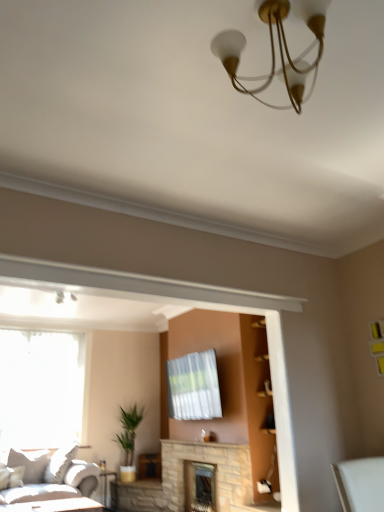
The image size is (384, 512). Describe the element at coordinates (274, 49) in the screenshot. I see `matte gold chandelier at upper center` at that location.

Measure the distance between point (126, 448) and camera.

Point (126, 448) and camera are 5.98 meters apart.

This screenshot has width=384, height=512. What do you see at coordinates (128, 440) in the screenshot?
I see `green leafy plant at center` at bounding box center [128, 440].

In order to click on white sheer curtain at left in this screenshot , I will do `click(40, 388)`.

Identify the location of matte gold chandelier at upper center. (274, 49).

Considering the points (242, 482) and (60, 475), which point is behind, point (242, 482) or point (60, 475)?

Point (60, 475)

How different are the orientations of stone fireplace at center, which is the 1th fireplace from front to back, and light gray fabric couch at lower left in degrees?

The facing directions of stone fireplace at center, which is the 1th fireplace from front to back, and light gray fabric couch at lower left are 89.3 degrees apart.

Can you confirm if stone fireplace at center, which ranks as the second fireplace in back-to-front order, is wider than light gray fabric couch at lower left?

In fact, stone fireplace at center, which ranks as the second fireplace in back-to-front order, might be narrower than light gray fabric couch at lower left.

From the image's perspective, who appears lower, stone fireplace at center, which is the 1th fireplace from front to back, or light gray fabric couch at lower left?

stone fireplace at center, which is the 1th fireplace from front to back, from the image's perspective.

From a real-world perspective, does white glossy table at lower left sit lower than white sheer curtain at left?

Yes, from a real-world perspective, white glossy table at lower left is under white sheer curtain at left.

The width and height of the screenshot is (384, 512). Find the location of `window above the white glossy table at lower left (from the image's perspective)`. window above the white glossy table at lower left (from the image's perspective) is located at coordinates (40, 388).

Who is taller, white glossy table at lower left or white sheer curtain at left?

white sheer curtain at left is taller.

Is white glossy table at lower left inside the boundaries of white sheer curtain at left, or outside?

white glossy table at lower left is outside white sheer curtain at left.

Is light gray fabric couch at lower left taller or shorter than white glossy table at lower left?

light gray fabric couch at lower left is taller than white glossy table at lower left.

I want to click on studio couch above the white glossy table at lower left (from a real-world perspective), so click(47, 477).

Is light gray fabric couch at lower left not within white glossy table at lower left?

light gray fabric couch at lower left is positioned outside white glossy table at lower left.

Considering the relative sizes of green leafy plant at center and light gray fabric couch at lower left in the image provided, is green leafy plant at center thinner than light gray fabric couch at lower left?

Indeed, green leafy plant at center has a lesser width compared to light gray fabric couch at lower left.

Is green leafy plant at center in contact with light gray fabric couch at lower left?

green leafy plant at center and light gray fabric couch at lower left are clearly separated.

From a real-world perspective, is green leafy plant at center positioned under light gray fabric couch at lower left based on gravity?

Incorrect, from a real-world perspective, green leafy plant at center is higher than light gray fabric couch at lower left.

Can you confirm if white sheer curtain at left is wider than green leafy plant at center?

Incorrect, the width of white sheer curtain at left does not surpass that of green leafy plant at center.

Consider the image. Is the position of white sheer curtain at left less distant than that of green leafy plant at center?

Yes.

Is white sheer curtain at left facing towards green leafy plant at center?

No, white sheer curtain at left is not aimed at green leafy plant at center.

Which is behind, point (284, 5) or point (129, 410)?

The point (129, 410) is behind.

From the image's perspective, is matte gold chandelier at upper center on top of green leafy plant at center?

Yes, from the image's perspective, matte gold chandelier at upper center is above green leafy plant at center.

Considering the relative positions of matte gold chandelier at upper center and green leafy plant at center in the image provided, is matte gold chandelier at upper center to the left of green leafy plant at center from the viewer's perspective?

Result: Incorrect, matte gold chandelier at upper center is not on the left side of green leafy plant at center.

Choose the correct answer: Is matte gold chandelier at upper center inside green leafy plant at center or outside it?

matte gold chandelier at upper center is spatially situated outside green leafy plant at center.

From a real-world perspective, is light gray fabric couch at lower left positioned over stone fireplace at center, which is the 1th fireplace from front to back, based on gravity?

Indeed, from a real-world perspective, light gray fabric couch at lower left stands above stone fireplace at center, which is the 1th fireplace from front to back.

Is light gray fabric couch at lower left inside the boundaries of stone fireplace at center, which is the 1th fireplace from front to back, or outside?

light gray fabric couch at lower left lies outside stone fireplace at center, which is the 1th fireplace from front to back.

Which fireplace is the 1st one when counting from the back of the light gray fabric couch at lower left? Please provide its 2D coordinates.

[(215, 476)]

Between light gray fabric couch at lower left and stone fireplace at center, which ranks as the second fireplace in back-to-front order, which one has larger width?

With larger width is light gray fabric couch at lower left.

Where is `the 1st fireplace counting from the right side of the light gray fabric couch at lower left`? the 1st fireplace counting from the right side of the light gray fabric couch at lower left is located at coordinates (215, 476).

Where is `table in front of the white sheer curtain at left`? table in front of the white sheer curtain at left is located at coordinates (55, 506).

From the picture: Considering their positions, is green leafy plant at center positioned closer to white glossy table at lower left than stone fireplace at center, which is the 1th fireplace from front to back?

green leafy plant at center lies closer to white glossy table at lower left than the other object.

Estimate the real-world distances between objects in this image. Which object is further from matte gold chandelier at upper center, white glossy table at lower left or green leafy plant at center?

white glossy table at lower left is positioned further to the anchor matte gold chandelier at upper center.

When comparing their distances from white sheer curtain at left, does stone fireplace at center, the second fireplace when ordered from front to back, or stone fireplace at center, which is the 1th fireplace from front to back, seem closer?

Based on the image, stone fireplace at center, which is the 1th fireplace from front to back, appears to be nearer to white sheer curtain at left.

From the picture: Which object lies further to the anchor point light gray fabric couch at lower left, stone fireplace at center, which ranks as the second fireplace in back-to-front order, or green leafy plant at center?

stone fireplace at center, which ranks as the second fireplace in back-to-front order, is further to light gray fabric couch at lower left.

Which object lies further to the anchor point stone fireplace at center, the second fireplace when ordered from front to back, white sheer curtain at left or matte gold chandelier at upper center?

Based on the image, matte gold chandelier at upper center appears to be further to stone fireplace at center, the second fireplace when ordered from front to back.

Consider the image. From the image, which object appears to be nearer to white sheer curtain at left, stone fireplace at center, which ranks as the second fireplace in back-to-front order, or matte gold chandelier at upper center?

The object closer to white sheer curtain at left is stone fireplace at center, which ranks as the second fireplace in back-to-front order.

Looking at this image, when comparing their distances from white glossy table at lower left, does green leafy plant at center or white sheer curtain at left seem further?

white sheer curtain at left is further to white glossy table at lower left.

Estimate the real-world distances between objects in this image. Which object is further from white glossy table at lower left, white sheer curtain at left or stone fireplace at center, which ranks as the second fireplace in back-to-front order?

Among the two, stone fireplace at center, which ranks as the second fireplace in back-to-front order, is located further to white glossy table at lower left.

This screenshot has height=512, width=384. Identify the location of fireplace that lies between matte gold chandelier at upper center and stone fireplace at center, which ranks as the 1th fireplace in back-to-front order, from top to bottom. (215, 476).

The image size is (384, 512). Identify the location of table positioned between matte gold chandelier at upper center and green leafy plant at center from near to far. (55, 506).

You are a GUI agent. You are given a task and a screenshot of the screen. Output one action in this format:
    pyautogui.click(x=<x>, y=<y>)
    Task: Click on the table between white sheer curtain at left and stone fireplace at center, which ranks as the 1th fireplace in back-to-front order
    
    Given the screenshot: What is the action you would take?
    pyautogui.click(x=55, y=506)

What are the coordinates of `studio couch between white sheer curtain at left and stone fireplace at center, which ranks as the second fireplace in back-to-front order` in the screenshot? It's located at (47, 477).